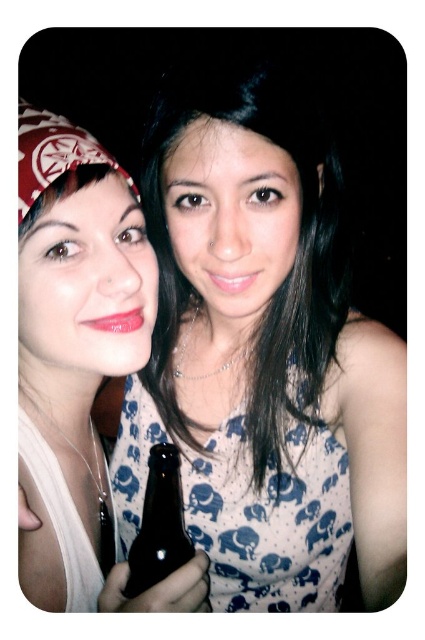
Question: Estimate the real-world distances between objects in this image. Which object is farther from the dark glass bottle at center?

Choices:
 (A) matte white dress at center
 (B) matte white tank top at left

Answer: (A)

Question: Which of the following is the farthest from the observer?

Choices:
 (A) (156, 476)
 (B) (402, 435)
 (C) (121, 566)

Answer: (B)

Question: Does matte white dress at center have a lesser width compared to matte white tank top at left?

Choices:
 (A) yes
 (B) no

Answer: (B)

Question: Which of these objects is positioned closest to the matte white dress at center?

Choices:
 (A) dark glass bottle at center
 (B) matte white tank top at left

Answer: (B)

Question: Does matte white dress at center appear on the right side of dark glass bottle at center?

Choices:
 (A) yes
 (B) no

Answer: (A)

Question: Is matte white tank top at left positioned before dark glass bottle at center?

Choices:
 (A) yes
 (B) no

Answer: (A)